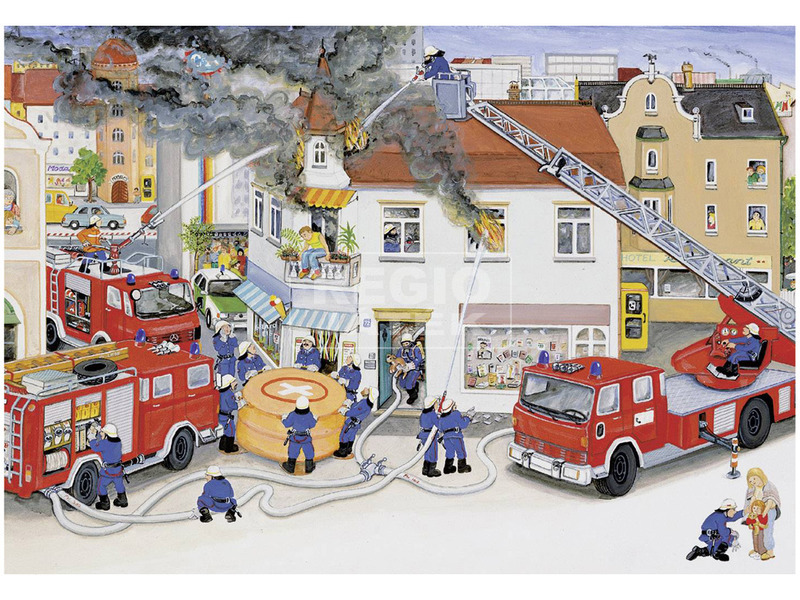
At what (x,y) coordinates should I click in order to perform the action: click on chimney. Please return your answer as a coordinate pair (x, y). This screenshot has width=800, height=600. Looking at the image, I should click on (688, 76).